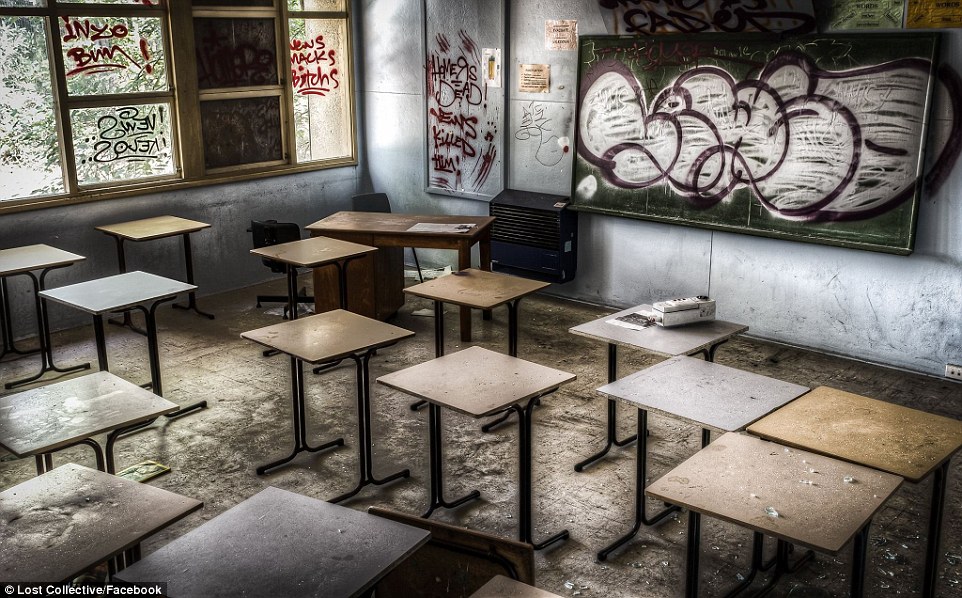
You are a GUI agent. You are given a task and a screenshot of the screen. Output one action in this format:
    pyautogui.click(x=<x>, y=<y>)
    Task: Click on the grey desks
    The image size is (962, 598).
    Given the screenshot: What is the action you would take?
    pyautogui.click(x=715, y=396), pyautogui.click(x=678, y=343), pyautogui.click(x=138, y=417), pyautogui.click(x=139, y=298)